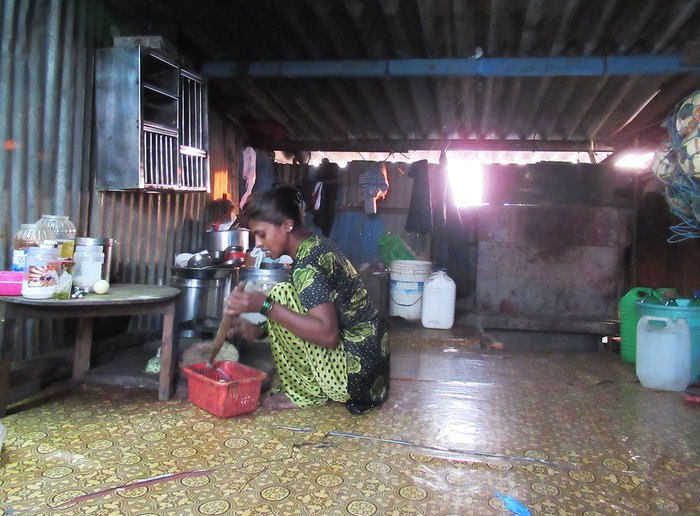
Identify the location of table. The height and width of the screenshot is (516, 700). (134, 293).